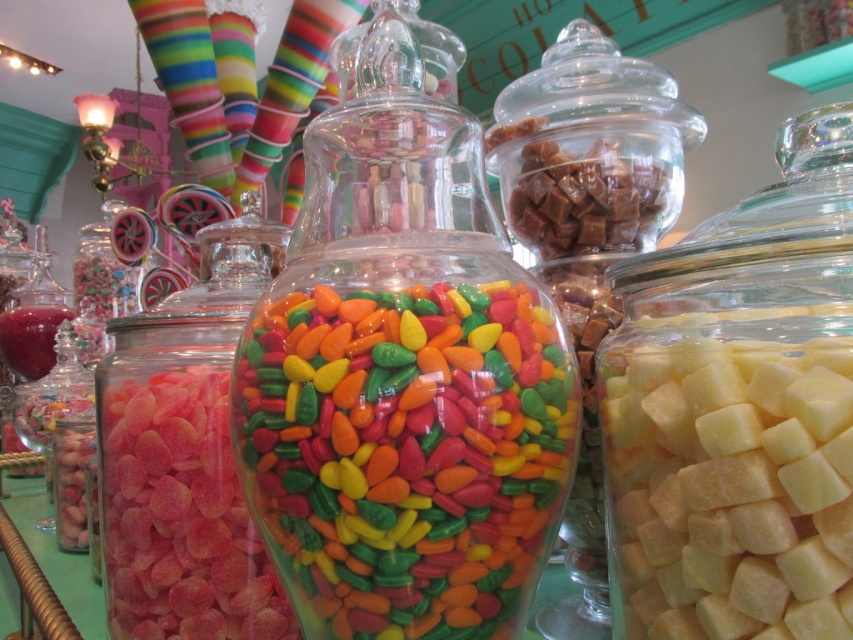
Question: Which of the following is the farthest from the observer?

Choices:
 (A) (445, 410)
 (B) (822, 163)

Answer: (B)

Question: Does glossy glass jar at center have a smaller size compared to glossy pink gummy at center?

Choices:
 (A) no
 (B) yes

Answer: (B)

Question: Observing the image, what is the correct spatial positioning of glossy glass jar at center in reference to glossy pink gummy at center?

Choices:
 (A) above
 (B) below

Answer: (A)

Question: Does translucent glass cubes at right lie in front of glossy glass jar at center?

Choices:
 (A) no
 (B) yes

Answer: (B)

Question: Which is farther from the glossy pink gummy at center?

Choices:
 (A) translucent glass cubes at right
 (B) glossy glass jar at center

Answer: (A)

Question: Which object is the closest to the translucent glass cubes at right?

Choices:
 (A) glossy pink gummy at center
 (B) glossy glass jar at center

Answer: (B)